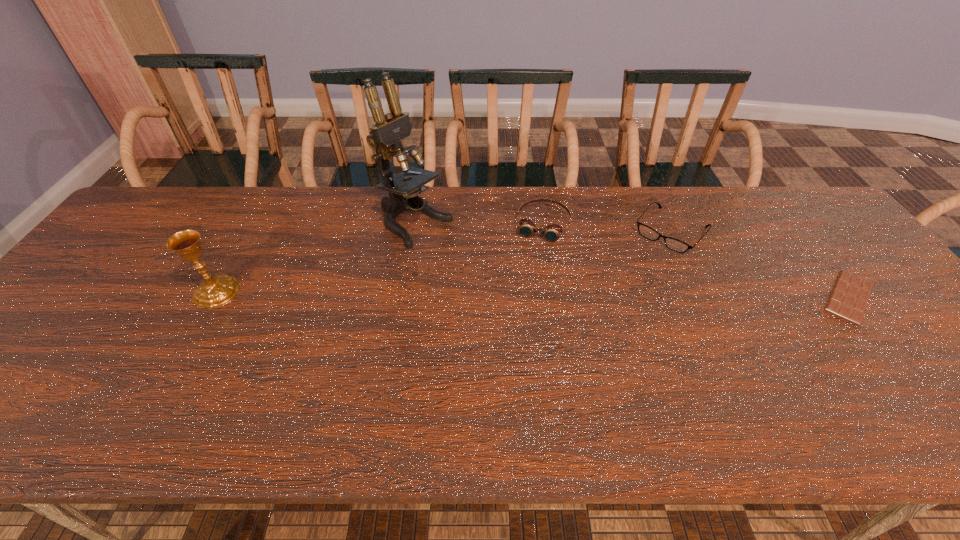
You are a GUI agent. You are given a task and a screenshot of the screen. Output one action in this format:
    pyautogui.click(x=<x>, y=<y>)
    Task: Click on the fourth shortest object
    
    Given the screenshot: What is the action you would take?
    pyautogui.click(x=216, y=291)

Find the location of a particular element. chalice is located at coordinates (216, 291).

Identify the location of the rightmost object. (849, 297).

Where is `the shortest object`? This screenshot has width=960, height=540. the shortest object is located at coordinates pyautogui.click(x=849, y=297).

Identify the location of the fourth tallest object. (673, 244).

The image size is (960, 540). Identify the location of spectacles. (673, 244).

This screenshot has height=540, width=960. Find the location of `microscope`. microscope is located at coordinates pyautogui.click(x=385, y=137).

You are a GUI agent. You are given a task and a screenshot of the screen. Output one action in this format:
    pyautogui.click(x=<x>, y=<y>)
    Task: Click on the fourth object from right to left
    The image size is (960, 540).
    Given the screenshot: What is the action you would take?
    pyautogui.click(x=385, y=137)

I want to click on the third tallest object, so click(x=552, y=232).

Where is `the third object from right to left`? the third object from right to left is located at coordinates (552, 232).